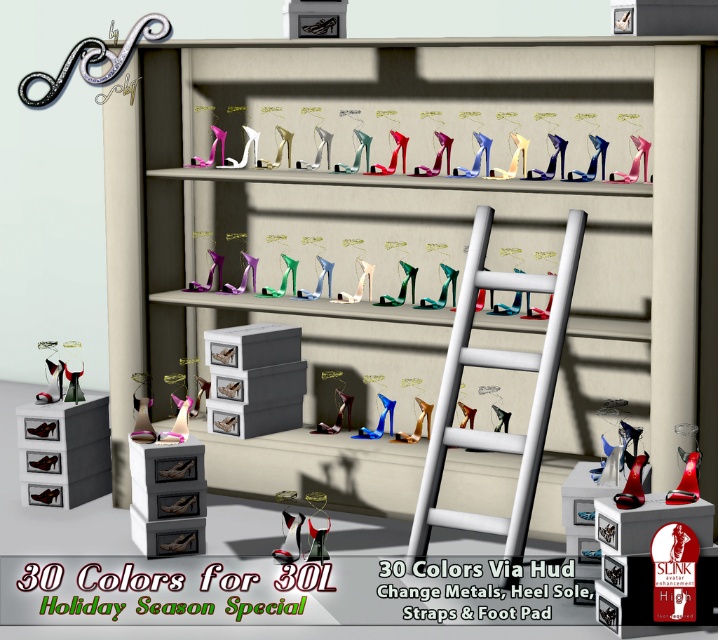
Question: Which object is farther from the camera taking this photo?

Choices:
 (A) metallic silver bookshelf at upper center
 (B) pink satin high heel at center
 (C) matte black high-heeled shoe at center
 (D) white ladder at center

Answer: (C)

Question: Is white ladder at center to the right of pink satin high heel at center from the viewer's perspective?

Choices:
 (A) no
 (B) yes

Answer: (B)

Question: Does metallic silver bookshelf at upper center appear over shiny black high-heeled shoe at center?

Choices:
 (A) no
 (B) yes

Answer: (B)

Question: Which point is closer to the camera?

Choices:
 (A) shiny black high-heeled shoe at center
 (B) pink satin high heel at center

Answer: (A)

Question: Considering the relative positions of white ladder at center and pink satin high heel at center in the image provided, where is white ladder at center located with respect to pink satin high heel at center?

Choices:
 (A) left
 (B) right

Answer: (B)

Question: Which point is farther to the camera?

Choices:
 (A) matte black high-heeled shoe at center
 (B) white ladder at center

Answer: (A)